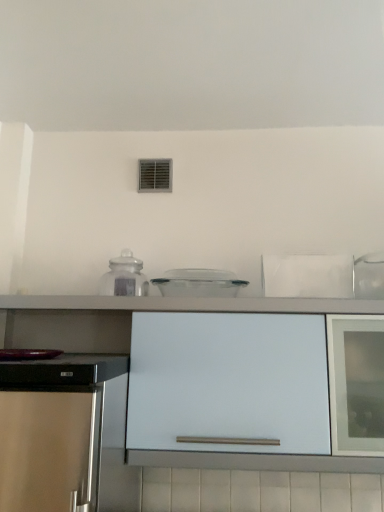
Question: Does transparent plastic container at center, the 2th kitchen appliance viewed from the left, appear on the left side of transparent glass jar at center, the first kitchen appliance positioned from the left?

Choices:
 (A) no
 (B) yes

Answer: (A)

Question: Can you confirm if transparent plastic container at center, the 2th kitchen appliance viewed from the left, is shorter than transparent glass jar at center, the 2th kitchen appliance when ordered from right to left?

Choices:
 (A) yes
 (B) no

Answer: (A)

Question: Does transparent plastic container at center, the 2th kitchen appliance viewed from the left, have a larger size compared to transparent glass jar at center, the 2th kitchen appliance when ordered from right to left?

Choices:
 (A) yes
 (B) no

Answer: (A)

Question: From the image's perspective, is transparent plastic container at center, which is counted as the first kitchen appliance, starting from the right, on top of transparent glass jar at center, the first kitchen appliance positioned from the left?

Choices:
 (A) yes
 (B) no

Answer: (B)

Question: From a real-world perspective, does transparent plastic container at center, which is counted as the first kitchen appliance, starting from the right, sit lower than transparent glass jar at center, the first kitchen appliance positioned from the left?

Choices:
 (A) no
 (B) yes

Answer: (B)

Question: From the image's perspective, is transparent plastic container at center, the 2th kitchen appliance viewed from the left, above or below transparent glass jar at center, the first kitchen appliance positioned from the left?

Choices:
 (A) above
 (B) below

Answer: (B)

Question: Is point (228, 283) positioned closer to the camera than point (122, 264)?

Choices:
 (A) farther
 (B) closer

Answer: (A)

Question: Based on their sizes in the image, would you say transparent plastic container at center, the 2th kitchen appliance viewed from the left, is bigger or smaller than transparent glass jar at center, the first kitchen appliance positioned from the left?

Choices:
 (A) small
 (B) big

Answer: (B)

Question: From a real-world perspective, relative to transparent glass jar at center, the 2th kitchen appliance when ordered from right to left, is transparent plastic container at center, the 2th kitchen appliance viewed from the left, vertically above or below?

Choices:
 (A) above
 (B) below

Answer: (B)

Question: Considering the positions of point (117, 285) and point (380, 445), is point (117, 285) closer or farther from the camera than point (380, 445)?

Choices:
 (A) farther
 (B) closer

Answer: (A)

Question: Is transparent glass jar at center, the first kitchen appliance positioned from the left, to the left or to the right of white matte cabinet at center in the image?

Choices:
 (A) left
 (B) right

Answer: (A)

Question: Is transparent glass jar at center, the first kitchen appliance positioned from the left, taller or shorter than white matte cabinet at center?

Choices:
 (A) short
 (B) tall

Answer: (A)

Question: From the image's perspective, is transparent glass jar at center, the first kitchen appliance positioned from the left, positioned above or below white matte cabinet at center?

Choices:
 (A) below
 (B) above

Answer: (B)

Question: Does point (230, 360) appear closer or farther from the camera than point (200, 289)?

Choices:
 (A) farther
 (B) closer

Answer: (B)

Question: Is white matte cabinet at center inside or outside of transparent plastic container at center, the 2th kitchen appliance viewed from the left?

Choices:
 (A) outside
 (B) inside

Answer: (A)